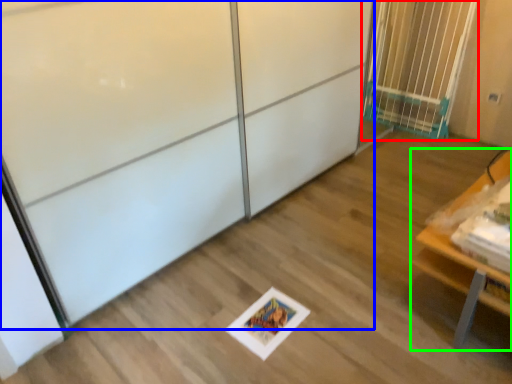
Question: Estimate the real-world distances between objects in this image. Which object is farther from elevator (highlighted by a red box), screen door (highlighted by a blue box) or furniture (highlighted by a green box)?

Choices:
 (A) screen door
 (B) furniture

Answer: (A)